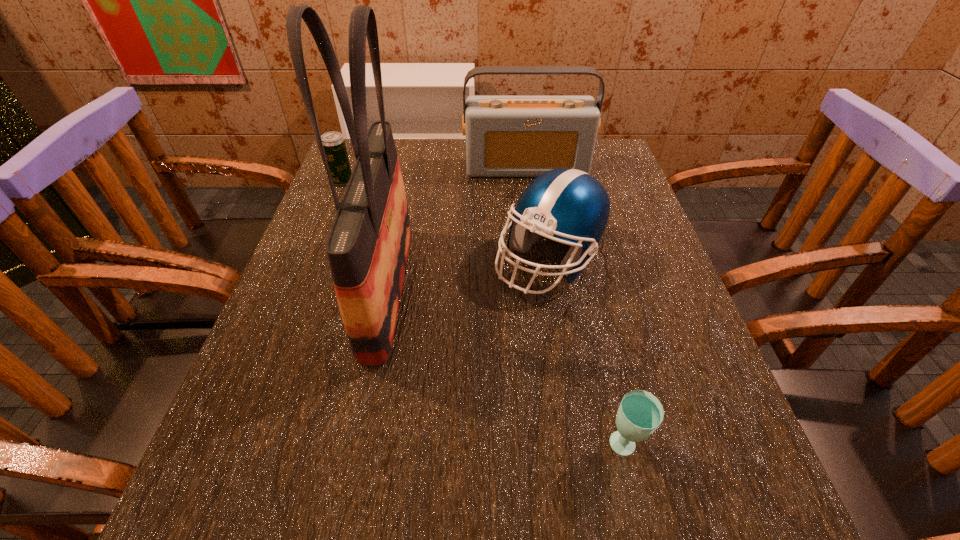
I want to click on empty location between the nearest object and the third shortest object, so click(586, 354).

This screenshot has width=960, height=540. I want to click on vacant space in between the beer can and the glass, so click(x=483, y=314).

I want to click on object that can be found as the fourth closest to the leftmost object, so click(640, 412).

This screenshot has height=540, width=960. I want to click on object that can be found as the third closest to the beer can, so click(x=569, y=204).

In order to click on vacant point that satisfies the following two spatial constraints: 1. at the front of the third shortest object with the faceguard; 2. on the front-facing side of the tallest object in this screenshot , I will do `click(554, 289)`.

Locate an element on the screen. free location that satisfies the following two spatial constraints: 1. on the front-facing side of the tallest object; 2. on the left side of the glass is located at coordinates (355, 448).

Image resolution: width=960 pixels, height=540 pixels. What are the coordinates of `vacant area in the image that satisfies the following two spatial constraints: 1. on the front-facing side of the glass; 2. on the right side of the radio receiver` in the screenshot? It's located at (566, 448).

Find the location of a particular element. This screenshot has width=960, height=540. vacant space that satisfies the following two spatial constraints: 1. on the front-facing side of the radio receiver; 2. on the front-facing side of the shopping bag is located at coordinates (544, 289).

Locate an element on the screen. The image size is (960, 540). blank space that satisfies the following two spatial constraints: 1. on the front-facing side of the fourth shortest object; 2. on the right side of the glass is located at coordinates (566, 448).

At what (x,y) coordinates should I click in order to perform the action: click on free location that satisfies the following two spatial constraints: 1. on the front-facing side of the second tallest object; 2. on the front-facing side of the shopping bag. Please return your answer as a coordinate pair (x, y). The image size is (960, 540). Looking at the image, I should click on (544, 289).